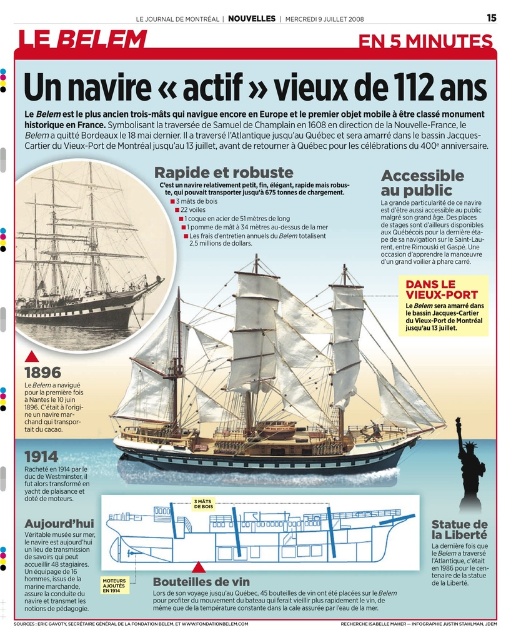
Question: Is wooden ship at center above rustic wood ship at center?

Choices:
 (A) no
 (B) yes

Answer: (A)

Question: Considering the relative positions of wooden ship at center and rustic wood ship at center in the image provided, where is wooden ship at center located with respect to rustic wood ship at center?

Choices:
 (A) right
 (B) left

Answer: (A)

Question: Is wooden ship at center in front of rustic wood ship at center?

Choices:
 (A) no
 (B) yes

Answer: (B)

Question: Which of the following is the closest to the observer?

Choices:
 (A) rustic wood ship at center
 (B) wooden ship at center

Answer: (B)